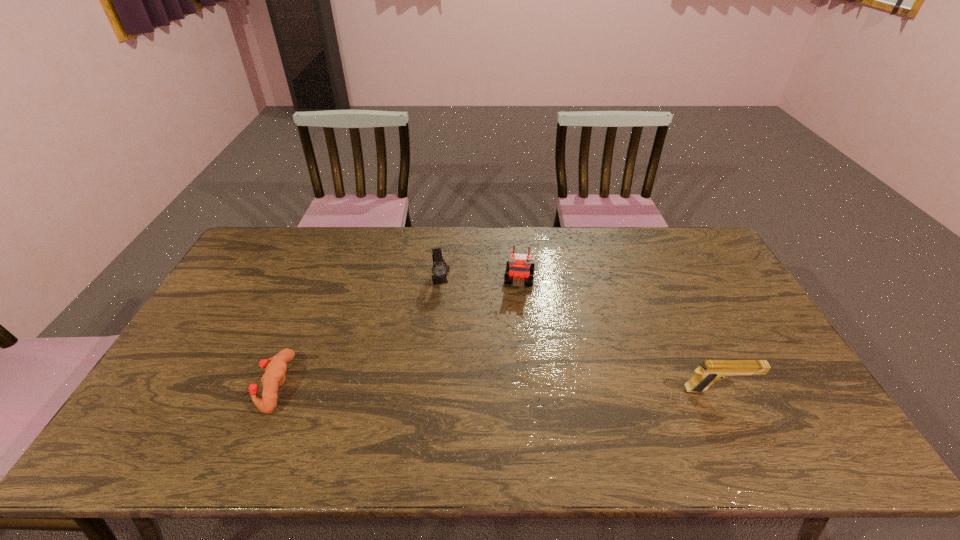
Find the location of `vacant spot on the desktop that is between the puncher and the rightmost object and is positioned on the front-facing side of the Lego`. vacant spot on the desktop that is between the puncher and the rightmost object and is positioned on the front-facing side of the Lego is located at coordinates (507, 388).

What are the coordinates of `free spot on the desktop that is between the puncher and the rightmost object and is positioned on the face of the watch` in the screenshot? It's located at (468, 387).